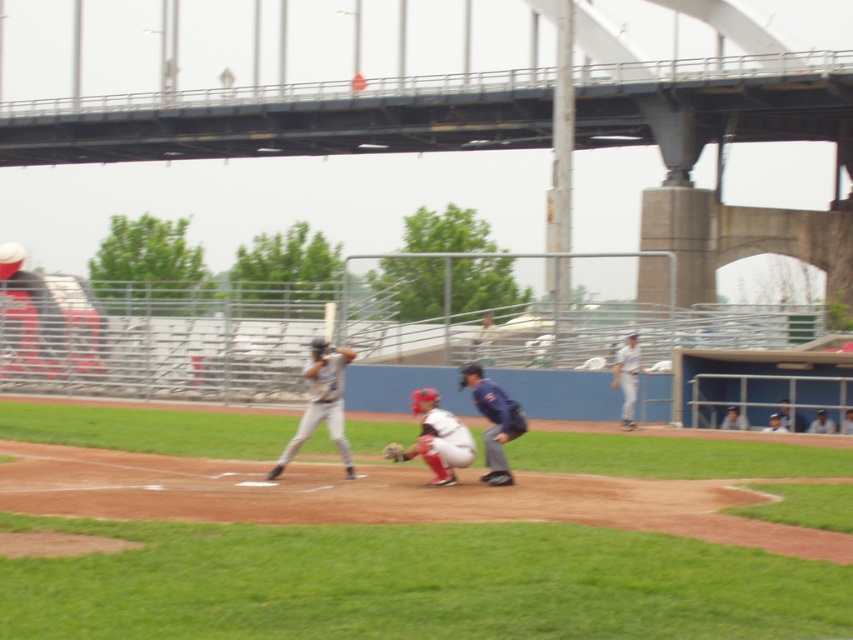
Is white matte uniform at center taller than wooden baseball bat at center?

Correct, white matte uniform at center is much taller as wooden baseball bat at center.

Image resolution: width=853 pixels, height=640 pixels. What are the coordinates of `white matte uniform at center` in the screenshot? It's located at (437, 438).

The width and height of the screenshot is (853, 640). In order to click on white matte uniform at center in this screenshot , I will do `click(437, 438)`.

In the scene shown: Can you confirm if gray matte uniform at center is positioned to the left of wooden baseball bat at center?

No, gray matte uniform at center is not to the left of wooden baseball bat at center.

Which is below, gray matte uniform at center or wooden baseball bat at center?

gray matte uniform at center is lower down.

Does point (329, 416) come behind point (329, 342)?

No, it is not.

Where is `gray matte uniform at center`? This screenshot has width=853, height=640. gray matte uniform at center is located at coordinates (322, 404).

Does gray matte uniform at center have a greater width compared to brown leather glove at center?

Yes, gray matte uniform at center is wider than brown leather glove at center.

Does gray matte uniform at center have a smaller size compared to brown leather glove at center?

Incorrect, gray matte uniform at center is not smaller in size than brown leather glove at center.

Locate an element on the screen. gray matte uniform at center is located at coordinates (322, 404).